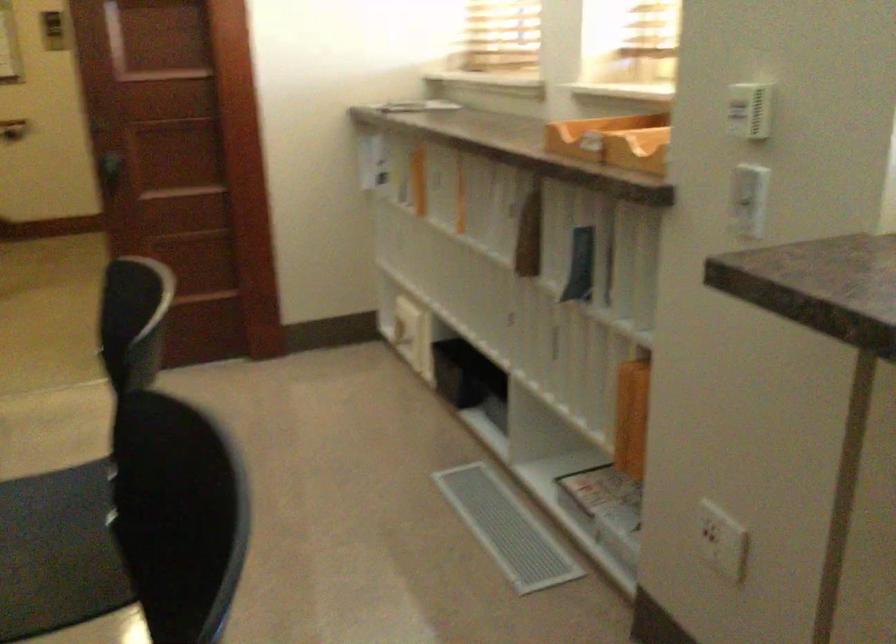
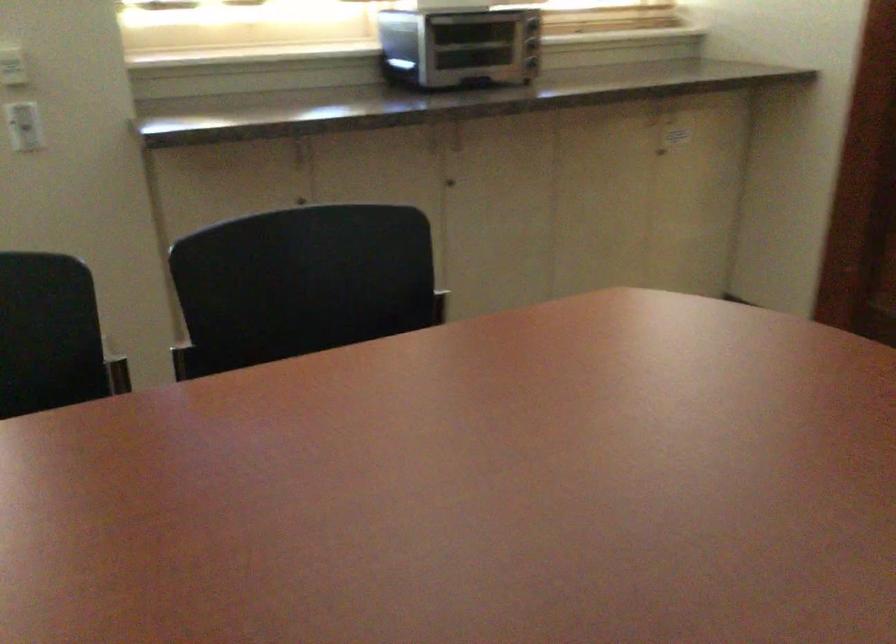
Find the pixel in the second image that matches [754,109] in the first image.

(11, 62)